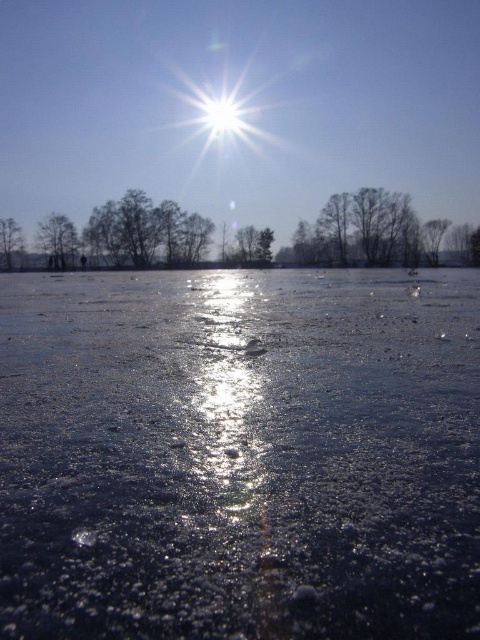
Question: Estimate the real-world distances between objects in this image. Which object is closer to the silvery metallic tree at upper left?

Choices:
 (A) smooth gray tree at upper right
 (B) smooth gray tree at left

Answer: (B)

Question: Where is transparent ice at center located in relation to smooth gray tree at left in the image?

Choices:
 (A) above
 (B) below

Answer: (B)

Question: Does transparent ice at center appear on the left side of smooth gray tree at upper right?

Choices:
 (A) yes
 (B) no

Answer: (A)

Question: Which of the following is the farthest from the observer?

Choices:
 (A) transparent ice at center
 (B) smooth gray tree at upper right
 (C) silvery metallic tree at upper left

Answer: (C)

Question: Can you confirm if transparent ice at center is smaller than silvery metallic tree at upper left?

Choices:
 (A) yes
 (B) no

Answer: (B)

Question: Which point appears farthest from the camera in this image?

Choices:
 (A) (39, 240)
 (B) (437, 244)

Answer: (A)